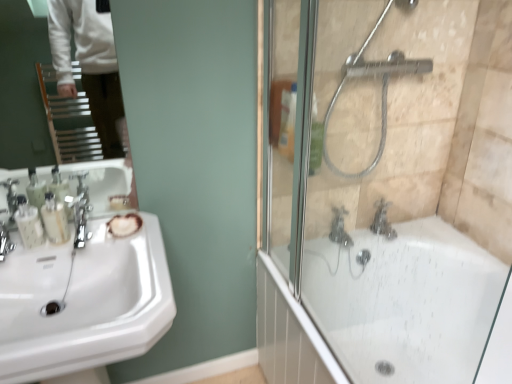
Question: Is satin nickel faucet at left, positioned as the 2th faucet in right-to-left order, at the left side of white glossy bathtub at right?

Choices:
 (A) yes
 (B) no

Answer: (A)

Question: From the image's perspective, is satin nickel faucet at left, marked as the first faucet in a left-to-right arrangement, located above white glossy bathtub at right?

Choices:
 (A) no
 (B) yes

Answer: (B)

Question: From the image's perspective, is satin nickel faucet at left, marked as the first faucet in a left-to-right arrangement, located beneath white glossy bathtub at right?

Choices:
 (A) yes
 (B) no

Answer: (B)

Question: Does satin nickel faucet at left, positioned as the 2th faucet in right-to-left order, have a lesser width compared to white glossy bathtub at right?

Choices:
 (A) yes
 (B) no

Answer: (A)

Question: From a real-world perspective, is satin nickel faucet at left, marked as the first faucet in a left-to-right arrangement, physically above white glossy bathtub at right?

Choices:
 (A) no
 (B) yes

Answer: (B)

Question: Considering the relative sizes of satin nickel faucet at left, positioned as the 2th faucet in right-to-left order, and white glossy bathtub at right in the image provided, is satin nickel faucet at left, positioned as the 2th faucet in right-to-left order, shorter than white glossy bathtub at right?

Choices:
 (A) no
 (B) yes

Answer: (B)

Question: Is translucent plastic soap dispenser at left, positioned as the first toiletry in right-to-left order, shorter than polished chrome faucet at left, the 1th faucet viewed from the right?

Choices:
 (A) yes
 (B) no

Answer: (B)

Question: Are translucent plastic soap dispenser at left, positioned as the first toiletry in right-to-left order, and polished chrome faucet at left, the 1th faucet viewed from the right, far apart?

Choices:
 (A) no
 (B) yes

Answer: (A)

Question: From a real-world perspective, is translucent plastic soap dispenser at left, the second toiletry from the left, physically above polished chrome faucet at left, the 1th faucet viewed from the right?

Choices:
 (A) yes
 (B) no

Answer: (A)

Question: Can you confirm if translucent plastic soap dispenser at left, the second toiletry from the left, is bigger than polished chrome faucet at left, the 1th faucet viewed from the right?

Choices:
 (A) yes
 (B) no

Answer: (B)

Question: From the image's perspective, is translucent plastic soap dispenser at left, the second toiletry from the left, on top of polished chrome faucet at left, the 1th faucet viewed from the right?

Choices:
 (A) no
 (B) yes

Answer: (B)

Question: Is translucent plastic soap dispenser at left, positioned as the first toiletry in right-to-left order, further to the viewer compared to polished chrome faucet at left, the 1th faucet viewed from the right?

Choices:
 (A) no
 (B) yes

Answer: (B)

Question: Can you see silver metallic showerhead at upper right touching polished chrome faucet at left, the 2th faucet viewed from the left?

Choices:
 (A) no
 (B) yes

Answer: (A)